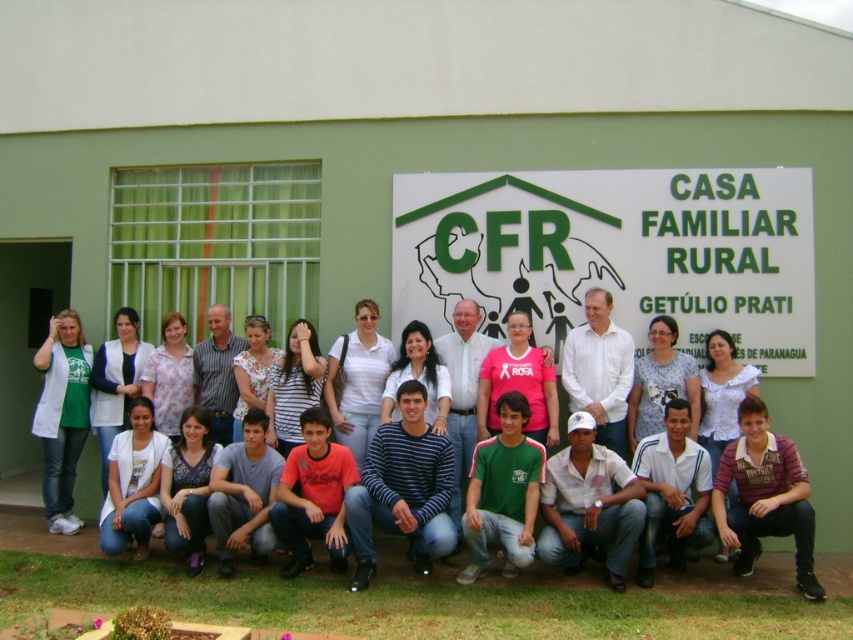
Does point (531, 417) come in front of point (115, 348)?

Yes, it is.

In order to click on pink fabric shirt at center in this screenshot , I will do pyautogui.click(x=518, y=385).

Measure the distance between point (352, 344) and camera.

The distance of point (352, 344) from camera is 26.35 feet.

Is white cotton shirt at center thinner than gray striped shirt at center?

In fact, white cotton shirt at center might be wider than gray striped shirt at center.

Which is in front, point (363, 358) or point (224, 396)?

Point (363, 358) is more forward.

You are a GUI agent. You are given a task and a screenshot of the screen. Output one action in this format:
    pyautogui.click(x=<x>, y=<y>)
    Task: Click on the white cotton shirt at center
    The width and height of the screenshot is (853, 640).
    Given the screenshot: What is the action you would take?
    pos(358,380)

Which of these two, striped cotton shirt at lower right or white cotton shirt at center, stands shorter?

striped cotton shirt at lower right is shorter.

What do you see at coordinates (764, 496) in the screenshot? This screenshot has height=640, width=853. I see `striped cotton shirt at lower right` at bounding box center [764, 496].

In order to click on striped cotton shirt at lower right in this screenshot , I will do `click(764, 496)`.